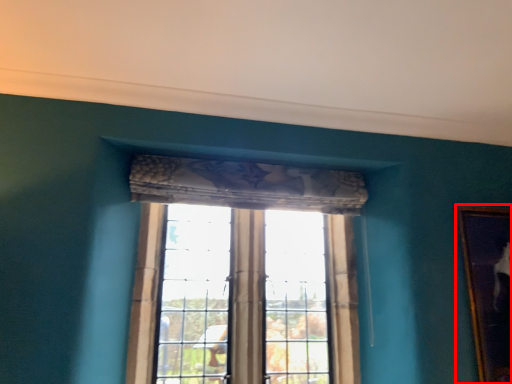
Question: Observing the image, what is the correct spatial positioning of picture frame (annotated by the red box) in reference to window?

Choices:
 (A) right
 (B) left

Answer: (A)